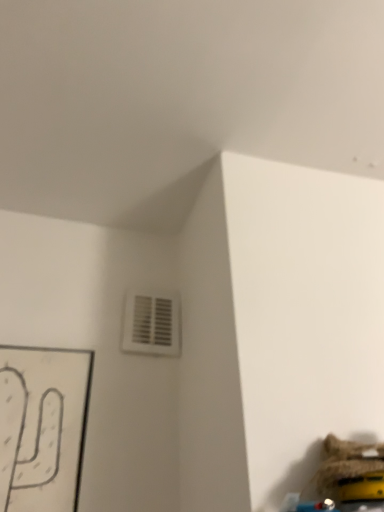
Question: Is white plastic vent at upper center facing away from fuzzy fabric toy at lower right?

Choices:
 (A) no
 (B) yes

Answer: (A)

Question: Does white plastic vent at upper center have a larger size compared to fuzzy fabric toy at lower right?

Choices:
 (A) yes
 (B) no

Answer: (B)

Question: Is white plastic vent at upper center taller than fuzzy fabric toy at lower right?

Choices:
 (A) yes
 (B) no

Answer: (A)

Question: From the image's perspective, is white plastic vent at upper center located beneath fuzzy fabric toy at lower right?

Choices:
 (A) yes
 (B) no

Answer: (B)

Question: Does white plastic vent at upper center have a lesser height compared to fuzzy fabric toy at lower right?

Choices:
 (A) no
 (B) yes

Answer: (A)

Question: Does white plastic vent at upper center have a smaller size compared to fuzzy fabric toy at lower right?

Choices:
 (A) yes
 (B) no

Answer: (A)

Question: Is fuzzy fabric toy at lower right next to white plastic vent at upper center and touching it?

Choices:
 (A) no
 (B) yes

Answer: (A)

Question: Does fuzzy fabric toy at lower right turn towards white plastic vent at upper center?

Choices:
 (A) no
 (B) yes

Answer: (A)

Question: Is fuzzy fabric toy at lower right positioned in front of white plastic vent at upper center?

Choices:
 (A) yes
 (B) no

Answer: (A)

Question: Is white plastic vent at upper center inside fuzzy fabric toy at lower right?

Choices:
 (A) yes
 (B) no

Answer: (B)

Question: Is fuzzy fabric toy at lower right not near white plastic vent at upper center?

Choices:
 (A) no
 (B) yes

Answer: (A)

Question: Is fuzzy fabric toy at lower right smaller than white plastic vent at upper center?

Choices:
 (A) no
 (B) yes

Answer: (A)

Question: In terms of width, does white plastic vent at upper center look wider or thinner when compared to fuzzy fabric toy at lower right?

Choices:
 (A) wide
 (B) thin

Answer: (B)